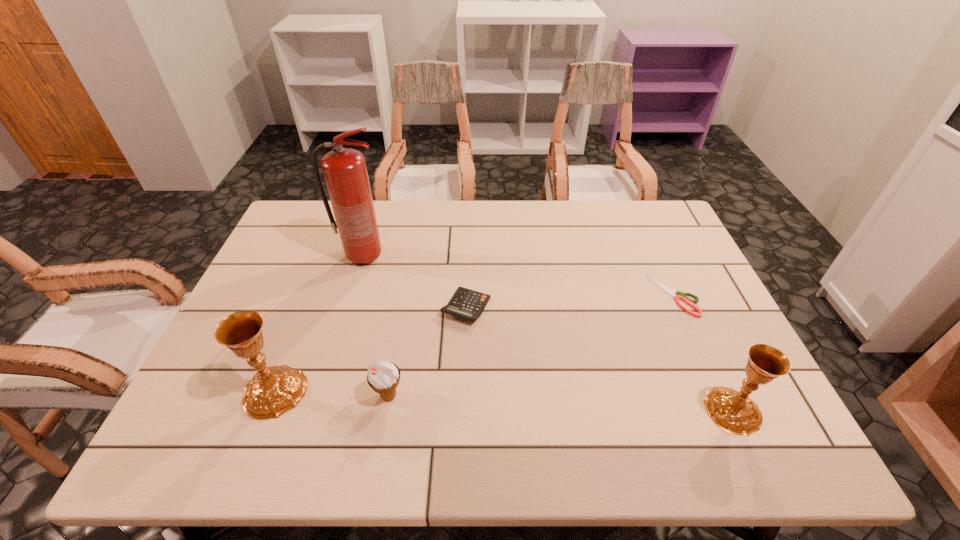
You are a GUI agent. You are given a task and a screenshot of the screen. Output one action in this format:
    pyautogui.click(x=<x>, y=<y>)
    Task: Click on the vacant area that satisfies the following two spatial constraints: 1. on the front side of the calculator; 2. on the left side of the fourth shortest object
    This screenshot has height=540, width=960.
    Given the screenshot: What is the action you would take?
    pyautogui.click(x=463, y=410)

Locate an element on the screen. This screenshot has width=960, height=540. vacant space that satisfies the following two spatial constraints: 1. on the handle side the tallest object; 2. on the front side of the left chalice is located at coordinates (324, 391).

Locate an element on the screen. The height and width of the screenshot is (540, 960). free point that satisfies the following two spatial constraints: 1. on the handle side the farthest object; 2. on the right side of the fourth shortest object is located at coordinates (318, 410).